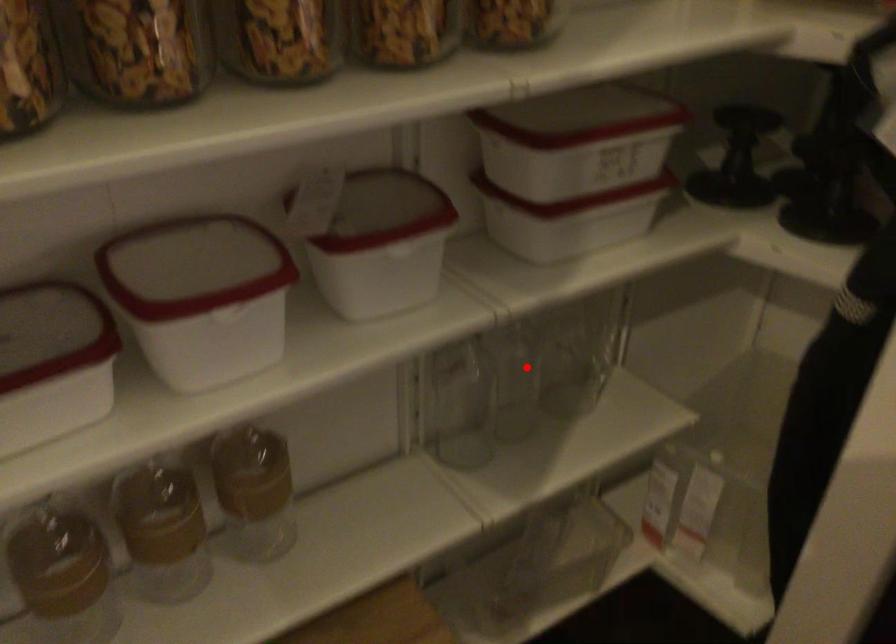
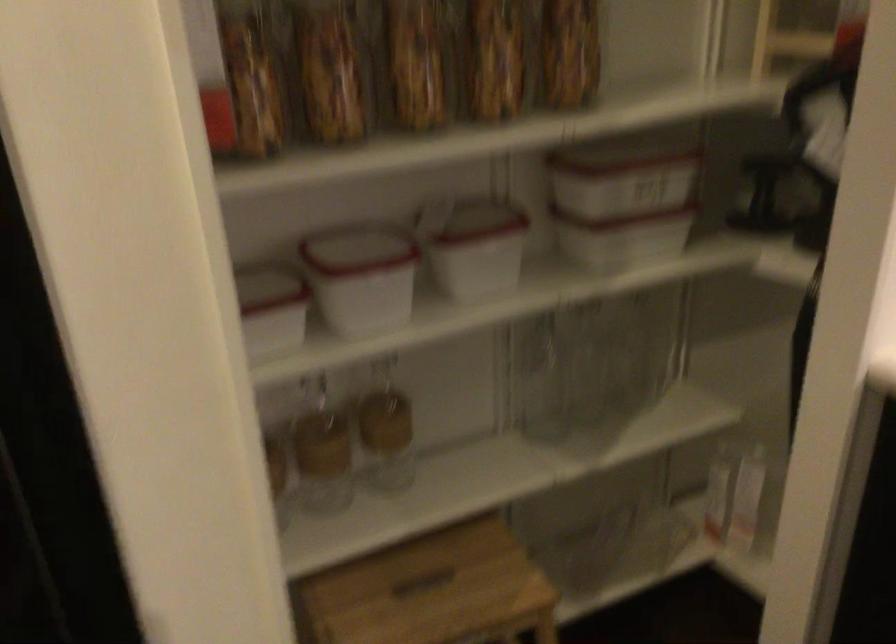
The point at the highlighted location is marked in the first image. Where is the corresponding point in the second image?

(599, 371)